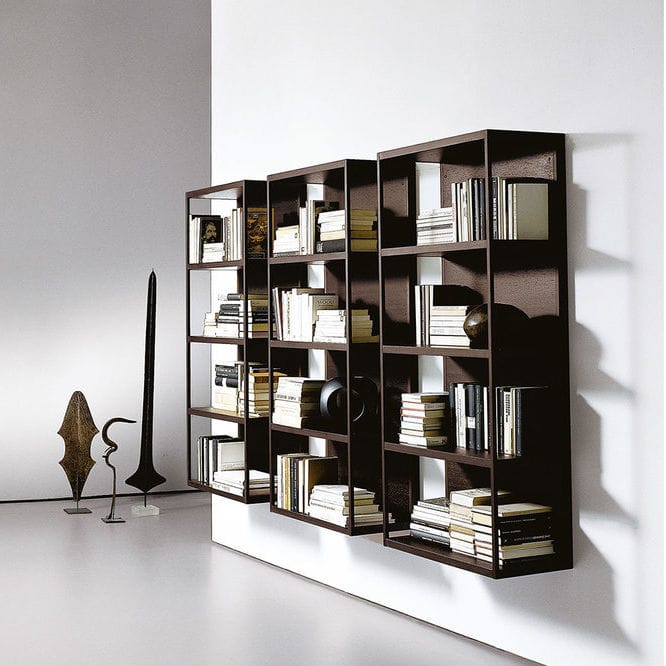
Identify the location of bookshelf two. (324, 226), (318, 306), (314, 386), (312, 478).